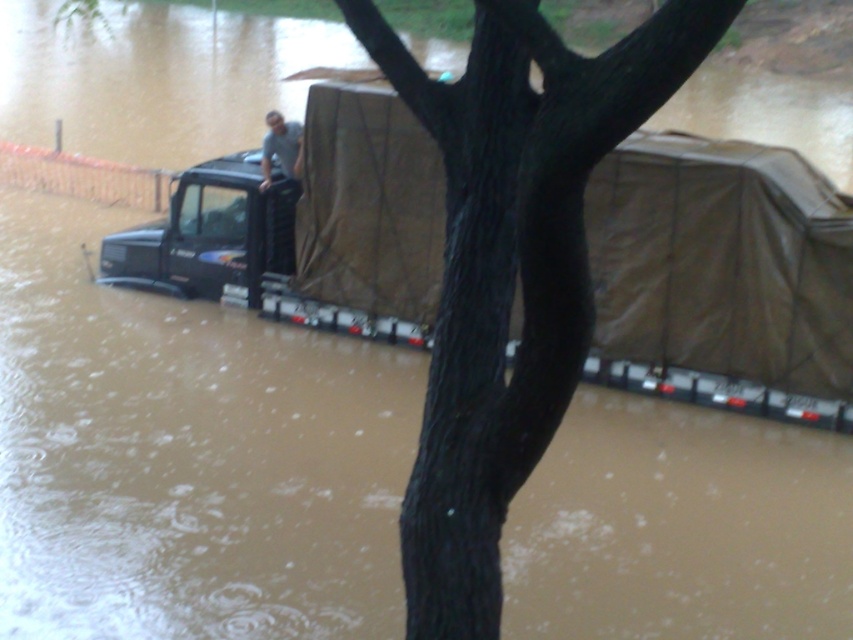
Describe the element at coordinates (210, 234) in the screenshot. I see `matte black truck at left` at that location.

Is the position of matte black truck at left less distant than that of gray fabric truck at center?

No, it is not.

What do you see at coordinates (210, 234) in the screenshot?
I see `matte black truck at left` at bounding box center [210, 234].

I want to click on matte black truck at left, so click(210, 234).

Is brown tarpaulin tent at center thinner than gray fabric truck at center?

In fact, brown tarpaulin tent at center might be wider than gray fabric truck at center.

Which of these two, brown tarpaulin tent at center or gray fabric truck at center, stands shorter?

gray fabric truck at center

The height and width of the screenshot is (640, 853). I want to click on brown tarpaulin tent at center, so click(722, 260).

Who is higher up, brown tarpaulin tent at center or matte black truck at left?

matte black truck at left

From the picture: Does brown tarpaulin tent at center have a greater width compared to matte black truck at left?

Indeed, brown tarpaulin tent at center has a greater width compared to matte black truck at left.

Locate an element on the screen. This screenshot has height=640, width=853. brown tarpaulin tent at center is located at coordinates (722, 260).